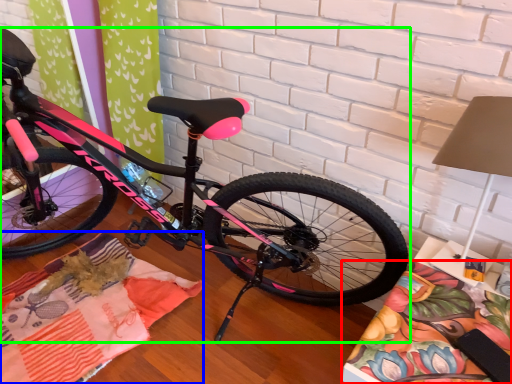
Question: Based on their relative distances, which object is nearer to blanket (highlighted by a red box)? Choose from blanket (highlighted by a blue box) and bicycle (highlighted by a green box).

Choices:
 (A) blanket
 (B) bicycle

Answer: (B)